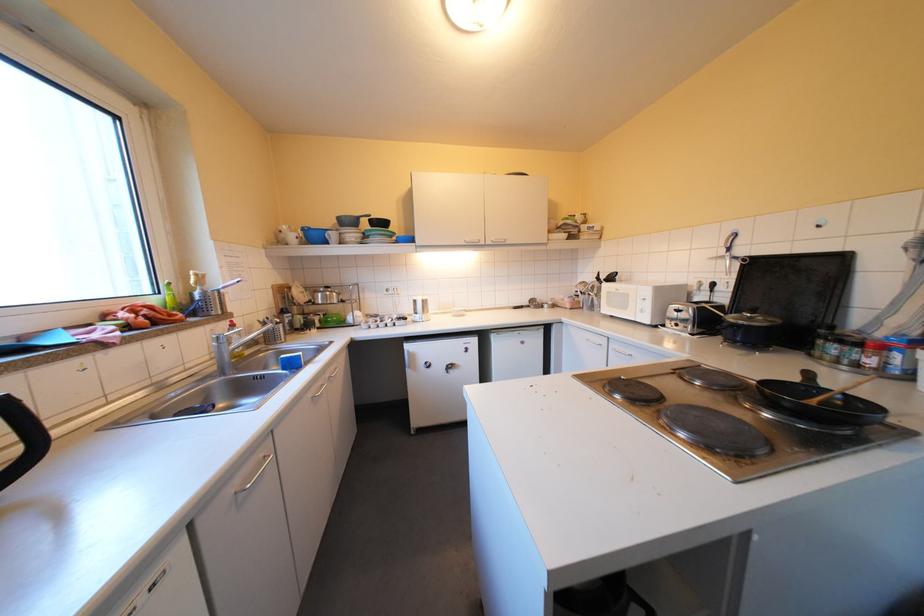
Find where to push the toaster lever. Please return your answer as a coordinate pair (x, y).

(675, 313)